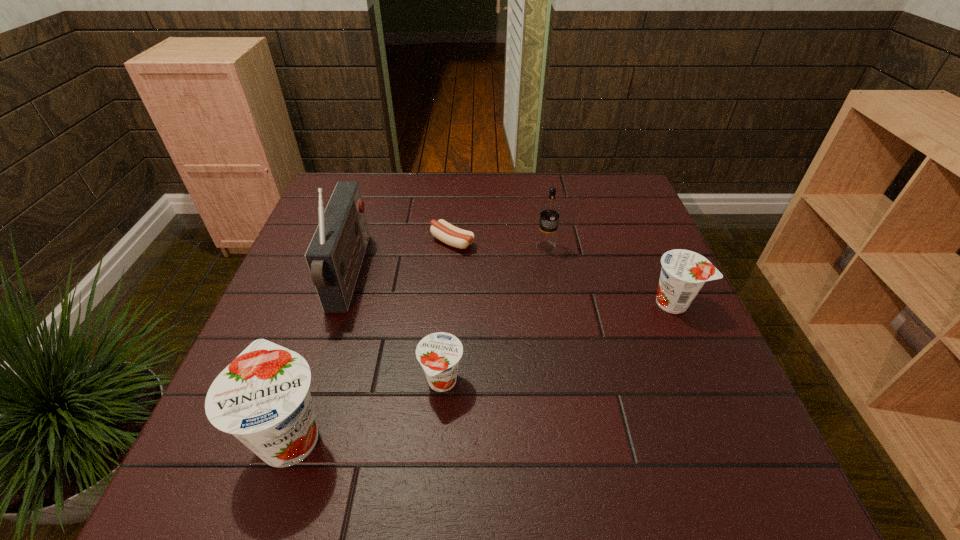
I want to click on location for an additional yogurt to make spacing equal, so click(x=567, y=339).